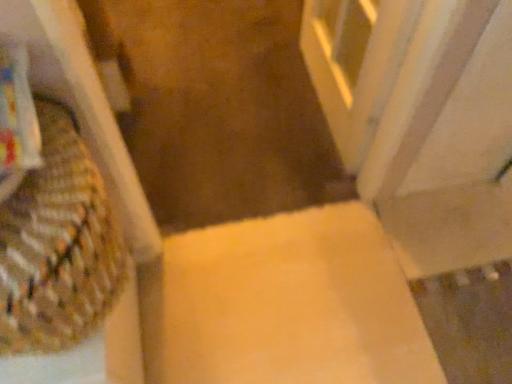
Question: Should I look upward or downward to see white marble screen door at upper right?

Choices:
 (A) up
 (B) down

Answer: (A)

Question: Considering the relative sizes of woven fabric basket at left and yellow carpet at center in the image provided, is woven fabric basket at left taller than yellow carpet at center?

Choices:
 (A) yes
 (B) no

Answer: (A)

Question: From a real-world perspective, does woven fabric basket at left sit lower than yellow carpet at center?

Choices:
 (A) no
 (B) yes

Answer: (A)

Question: Is woven fabric basket at left completely or partially outside of yellow carpet at center?

Choices:
 (A) no
 (B) yes

Answer: (B)

Question: From the image's perspective, is woven fabric basket at left on yellow carpet at center?

Choices:
 (A) yes
 (B) no

Answer: (B)

Question: Is woven fabric basket at left to the right of yellow carpet at center from the viewer's perspective?

Choices:
 (A) yes
 (B) no

Answer: (B)

Question: Does woven fabric basket at left turn towards yellow carpet at center?

Choices:
 (A) no
 (B) yes

Answer: (A)

Question: Can you confirm if woven fabric basket at left is thinner than matte yellow cardboard box at center?

Choices:
 (A) yes
 (B) no

Answer: (A)

Question: From the image's perspective, does woven fabric basket at left appear higher than matte yellow cardboard box at center?

Choices:
 (A) no
 (B) yes

Answer: (B)

Question: Can you confirm if woven fabric basket at left is taller than matte yellow cardboard box at center?

Choices:
 (A) no
 (B) yes

Answer: (B)

Question: Is woven fabric basket at left positioned before matte yellow cardboard box at center?

Choices:
 (A) yes
 (B) no

Answer: (A)

Question: Can you confirm if woven fabric basket at left is shorter than matte yellow cardboard box at center?

Choices:
 (A) yes
 (B) no

Answer: (B)

Question: Could you tell me if woven fabric basket at left is facing matte yellow cardboard box at center?

Choices:
 (A) no
 (B) yes

Answer: (A)

Question: Is matte yellow cardboard box at center taller than woven fabric basket at left?

Choices:
 (A) no
 (B) yes

Answer: (A)